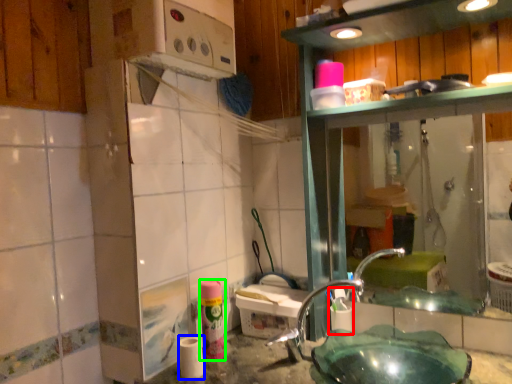
Question: Considering the real-world distances, which object is closest to shaving cream (highlighted by a red box)? toilet paper (highlighted by a blue box) or toiletry (highlighted by a green box).

Choices:
 (A) toilet paper
 (B) toiletry

Answer: (B)